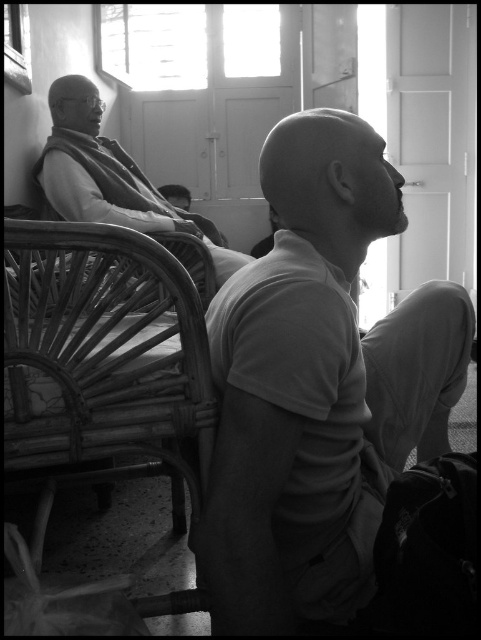
Is white cotton shirt at center positioned at the back of matte black robe at left?

No.

Can you confirm if white cotton shirt at center is positioned to the left of matte black robe at left?

Incorrect, white cotton shirt at center is not on the left side of matte black robe at left.

This screenshot has width=481, height=640. What do you see at coordinates (317, 387) in the screenshot? I see `white cotton shirt at center` at bounding box center [317, 387].

At what (x,y) coordinates should I click in order to perform the action: click on white cotton shirt at center. Please return your answer as a coordinate pair (x, y). Looking at the image, I should click on (317, 387).

Does white cotton shirt at center appear over woven wood chair at left?

Yes, white cotton shirt at center is above woven wood chair at left.

Can you confirm if white cotton shirt at center is shorter than woven wood chair at left?

No.

Does point (346, 264) lie in front of point (33, 381)?

No.

Find the location of a particular element. white cotton shirt at center is located at coordinates (317, 387).

Measure the distance from woven wood chair at left to matte black robe at left.

The distance of woven wood chair at left from matte black robe at left is 31.53 inches.

This screenshot has height=640, width=481. In order to click on woven wood chair at left in this screenshot , I will do `click(103, 353)`.

Does point (41, 417) come behind point (91, 179)?

No, it is in front of (91, 179).

Where is `woven wood chair at left`? woven wood chair at left is located at coordinates (103, 353).